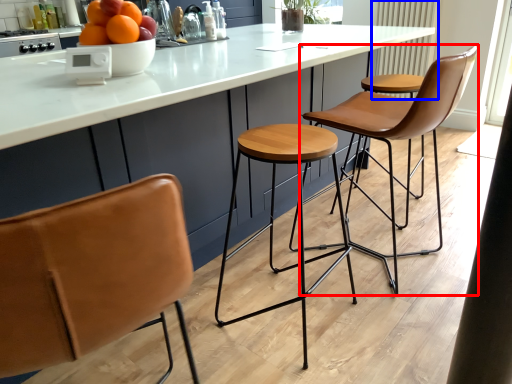
Question: Which object appears farthest to the camera in this image, chair (highlighted by a red box) or radiator (highlighted by a blue box)?

Choices:
 (A) chair
 (B) radiator

Answer: (B)